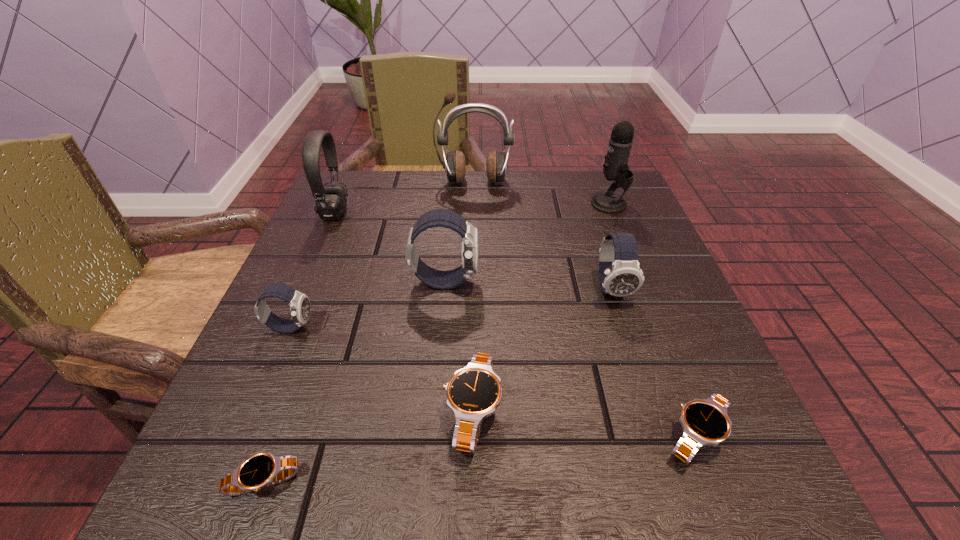
Find the location of a particular element. The image size is (960, 540). the farthest object is located at coordinates (455, 165).

Locate an element on the screen. earphone is located at coordinates (455, 165).

Image resolution: width=960 pixels, height=540 pixels. What are the coordinates of `black microphone` in the screenshot? It's located at (615, 168).

I want to click on headset, so click(330, 200).

Locate an element on the screen. This screenshot has width=960, height=540. the second dark watch from left to right is located at coordinates (437, 279).

At what (x,y) coordinates should I click in order to perform the action: click on the biggest dark watch. Please return your answer as a coordinate pair (x, y). The width and height of the screenshot is (960, 540). Looking at the image, I should click on (437, 279).

Locate an element on the screen. This screenshot has width=960, height=540. the fifth tallest object is located at coordinates (620, 275).

What are the coordinates of `the second smallest dark watch` in the screenshot? It's located at (620, 275).

Find the location of `the third tallest watch`. the third tallest watch is located at coordinates (299, 303).

Locate an element on the screen. The height and width of the screenshot is (540, 960). the fourth nearest watch is located at coordinates (299, 303).